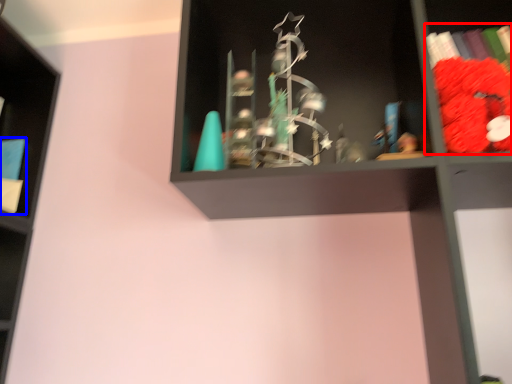
Question: Among these objects, which one is farthest to the camera, book (highlighted by a red box) or book (highlighted by a blue box)?

Choices:
 (A) book
 (B) book

Answer: (B)